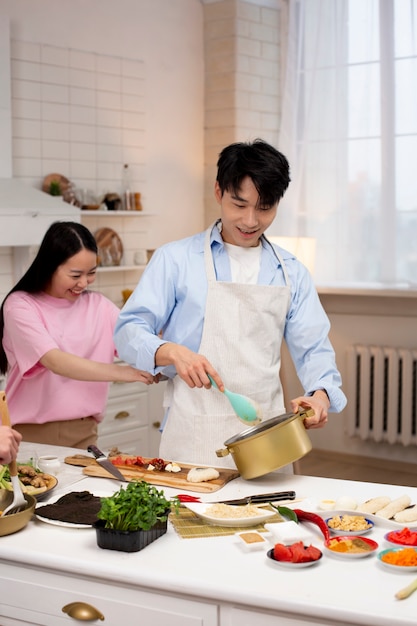
Where is `shelves`? shelves is located at coordinates (129, 211), (128, 265).